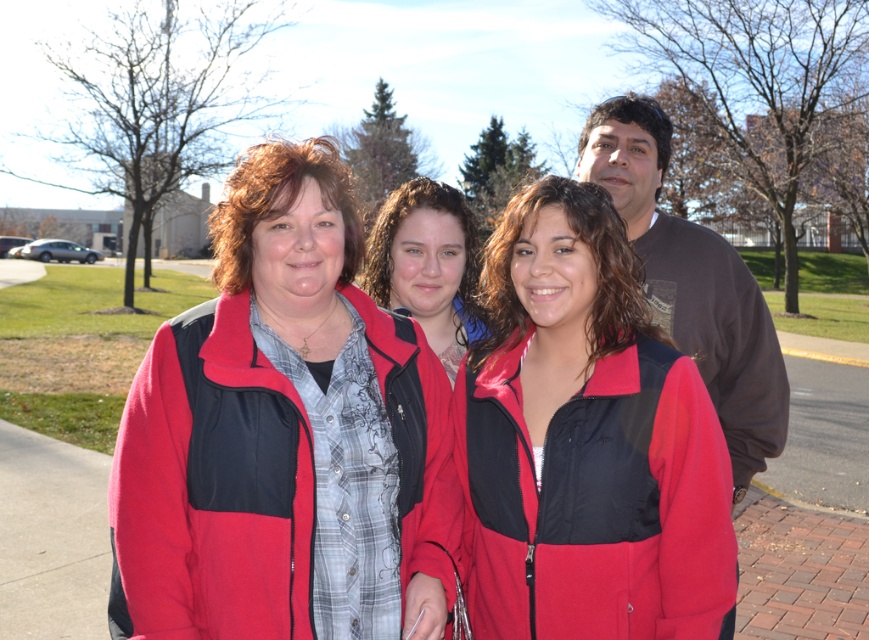
Is red fleece jacket at center further to camera compared to dark gray cotton shirt at upper right?

No, it is not.

From the picture: Can you confirm if red fleece jacket at center is positioned above dark gray cotton shirt at upper right?

No, red fleece jacket at center is not above dark gray cotton shirt at upper right.

Does point (498, 582) come behind point (702, 353)?

No, it is in front of (702, 353).

Image resolution: width=869 pixels, height=640 pixels. Identify the location of red fleece jacket at center. (595, 500).

Who is taller, matte fleece jacket at center or red fleece jackets at center?

Standing taller between the two is red fleece jackets at center.

Identify the location of matte fleece jacket at center. Image resolution: width=869 pixels, height=640 pixels. (211, 488).

Where is `matte fleece jacket at center`? matte fleece jacket at center is located at coordinates (211, 488).

Where is `matte fleece jacket at center`? The image size is (869, 640). matte fleece jacket at center is located at coordinates (211, 488).

Does matte fleece jacket at center appear on the left side of dark gray cotton shirt at upper right?

Yes, matte fleece jacket at center is to the left of dark gray cotton shirt at upper right.

Identify the location of matte fleece jacket at center. (211, 488).

Between point (283, 532) and point (673, 259), which one is positioned behind?

The point (673, 259) is behind.

I want to click on matte fleece jacket at center, so click(x=211, y=488).